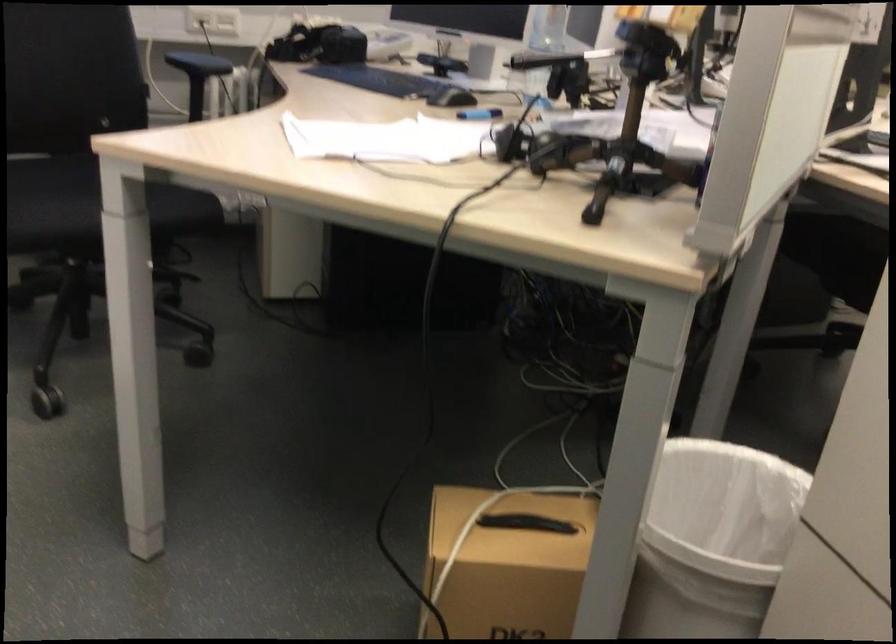
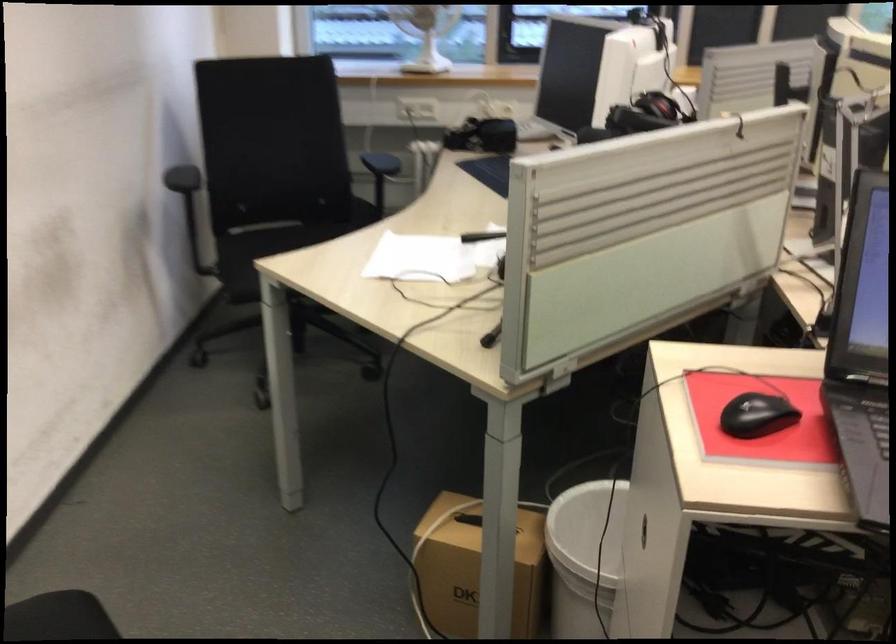
In the second image, find the point that corresponds to (x=362, y=146) in the first image.

(419, 259)